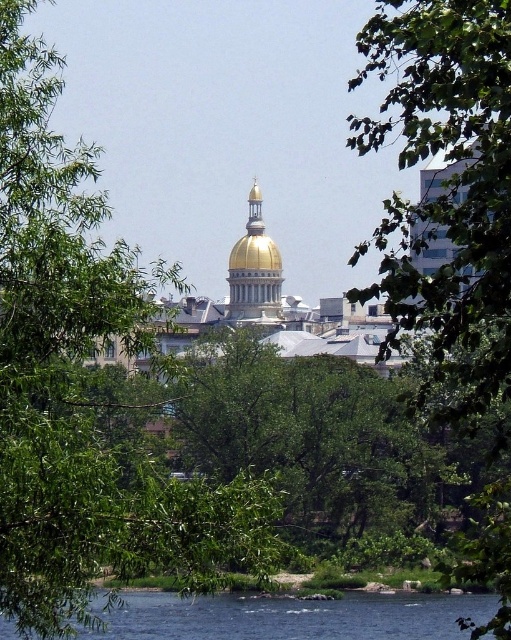
In the scene shown: Between green leafy tree at left and gold polished dome at center, which one has less height?

gold polished dome at center is shorter.

How much distance is there between green leafy tree at left and gold polished dome at center?

They are 192.58 meters apart.

Between point (127, 333) and point (254, 221), which one is positioned behind?

The point (254, 221) is behind.

The width and height of the screenshot is (511, 640). In order to click on green leafy tree at left in this screenshot , I will do `click(83, 385)`.

Is blue water at lower center wider than gold polished dome at center?

Indeed, blue water at lower center has a greater width compared to gold polished dome at center.

Between point (227, 612) and point (260, 246), which one is positioned in front?

Point (227, 612)

Where is `blue water at lower center`? The width and height of the screenshot is (511, 640). blue water at lower center is located at coordinates (292, 616).

Can you confirm if green leafy tree at center is positioned to the left of gold polished dome at center?

No, green leafy tree at center is not to the left of gold polished dome at center.

Does point (463, 413) lie behind point (258, 211)?

No, it is in front of (258, 211).

Find the location of a particular element. green leafy tree at center is located at coordinates (447, 193).